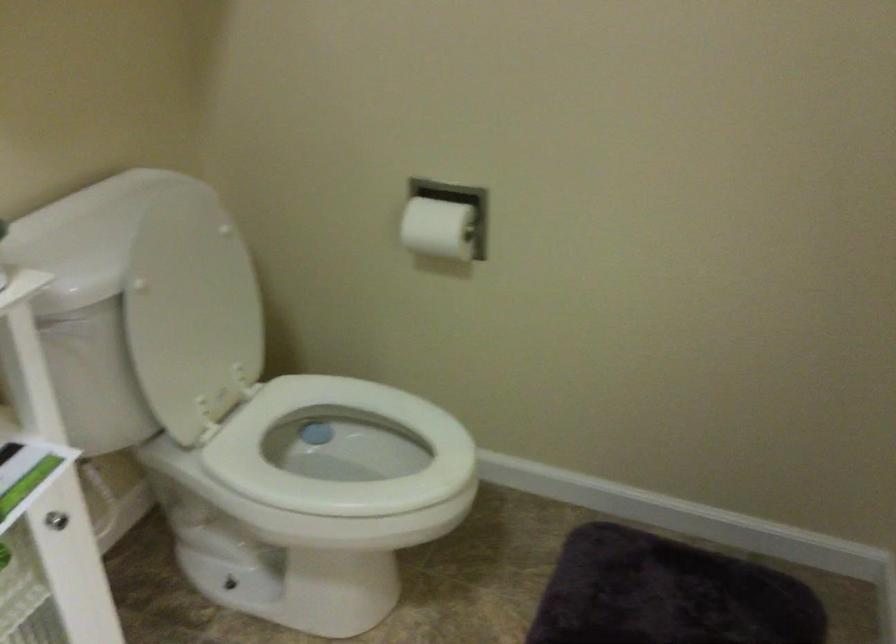
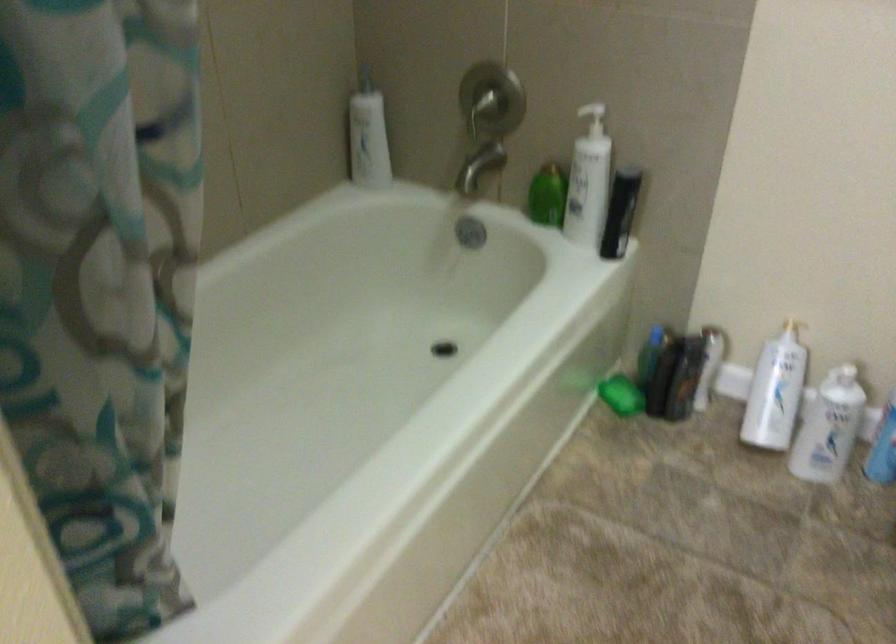
The first image is from the beginning of the video and the second image is from the end. How did the camera likely rotate when shooting the video?

The rotation direction of the camera is left-down.